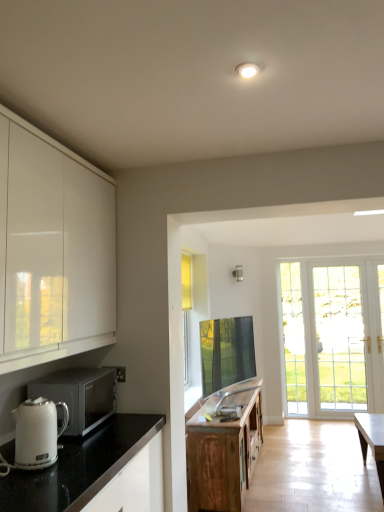
Question: Considering the positions of point (223, 492) and point (56, 399), is point (223, 492) closer or farther from the camera than point (56, 399)?

Choices:
 (A) farther
 (B) closer

Answer: (A)

Question: From a real-world perspective, is wooden cabinet at center above or below silver metallic microwave at left?

Choices:
 (A) below
 (B) above

Answer: (A)

Question: Considering the real-world distances, which object is closest to the white glossy electric kettle at lower left?

Choices:
 (A) white glossy countertop at lower left
 (B) silver metallic microwave at left
 (C) wooden cabinet at center

Answer: (A)

Question: Estimate the real-world distances between objects in this image. Which object is closer to the white glossy electric kettle at lower left?

Choices:
 (A) wooden cabinet at center
 (B) silver metallic microwave at left
 (C) white glossy countertop at lower left

Answer: (C)